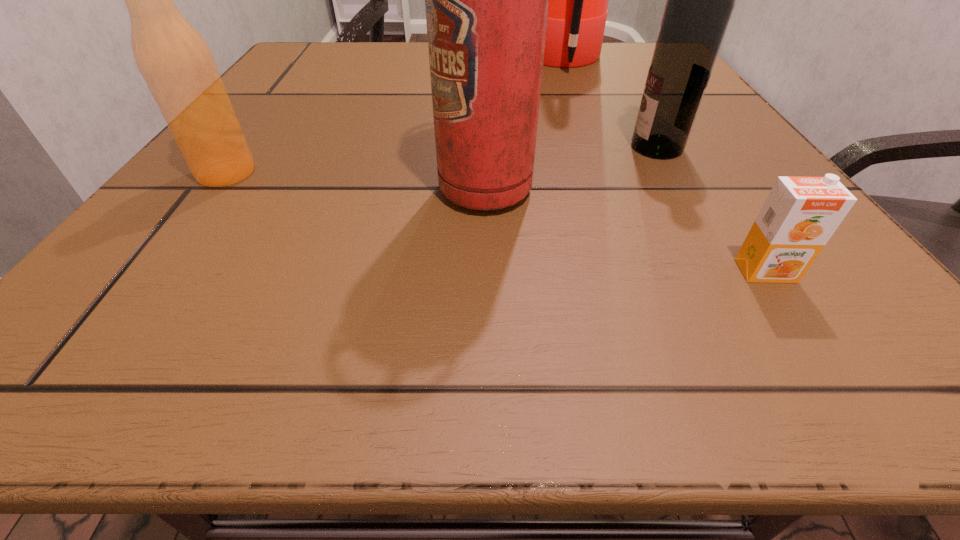
The image size is (960, 540). I want to click on the taller fire extinguisher, so click(x=578, y=0).

Image resolution: width=960 pixels, height=540 pixels. Identify the location of the farther fire extinguisher. (578, 0).

I want to click on the nearer fire extinguisher, so click(x=486, y=0).

The image size is (960, 540). Identify the location of the second tallest object. (486, 0).

This screenshot has width=960, height=540. I want to click on the third shortest object, so click(x=700, y=0).

At what (x,y) coordinates should I click in order to perform the action: click on beer bottle. Please return your answer as a coordinate pair (x, y). The width and height of the screenshot is (960, 540). Looking at the image, I should click on (178, 67).

What are the coordinates of `the second shortest object` in the screenshot? It's located at (178, 67).

Locate an element on the screen. Image resolution: width=960 pixels, height=540 pixels. the shortest object is located at coordinates pyautogui.click(x=800, y=214).

Where is `orange juice`? The width and height of the screenshot is (960, 540). orange juice is located at coordinates (800, 214).

This screenshot has width=960, height=540. What are the coordinates of `vacant space located 0.300m towards the nozzle of the taller fire extinguisher` in the screenshot? It's located at (386, 62).